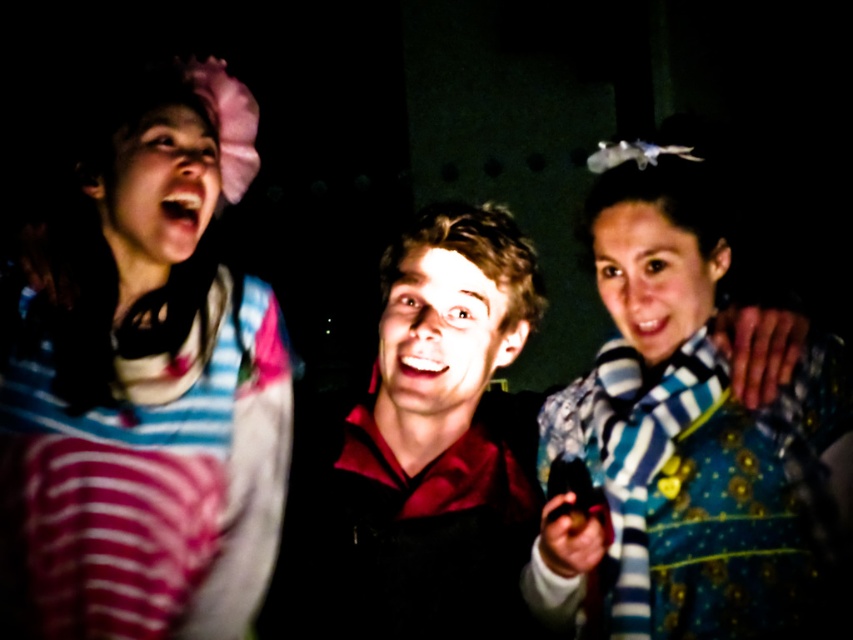
What are the coordinates of the matte red shirt at center?

The matte red shirt at center is located at point (421, 464).

You are a photographer trying to capture the scene. You notice two scarves at the center of the image. Which one is positioned lower between the blue striped scarf at center and the smooth blue scarf at center?

The blue striped scarf at center is located below the smooth blue scarf at center, so it is positioned lower.